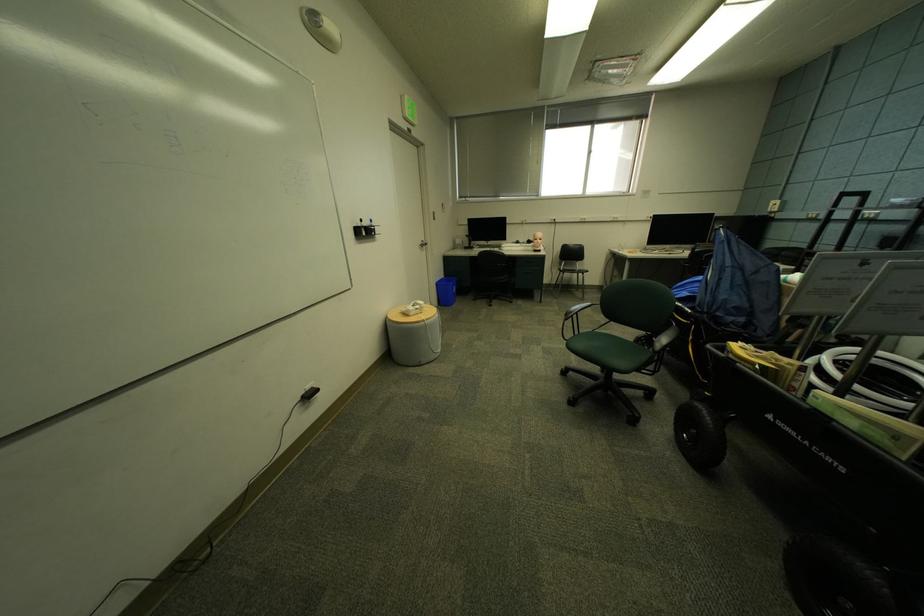
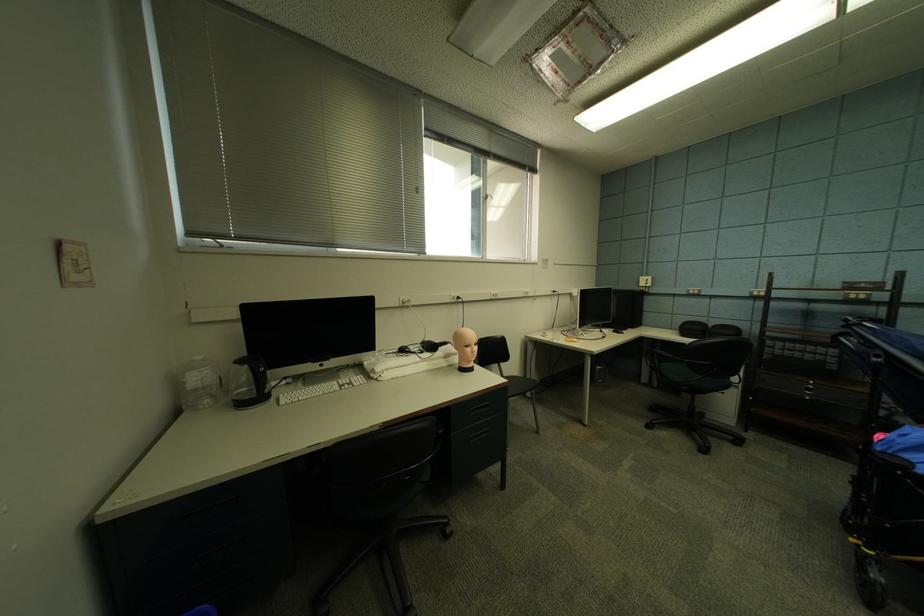
Question: I am providing you with two images of the same scene from different viewpoints. Please identify which objects are invisible in image2.

Choices:
 (A) clear water jug
 (B) black kettle handle
 (C) mannequin head
 (D) none of these

Answer: (D)